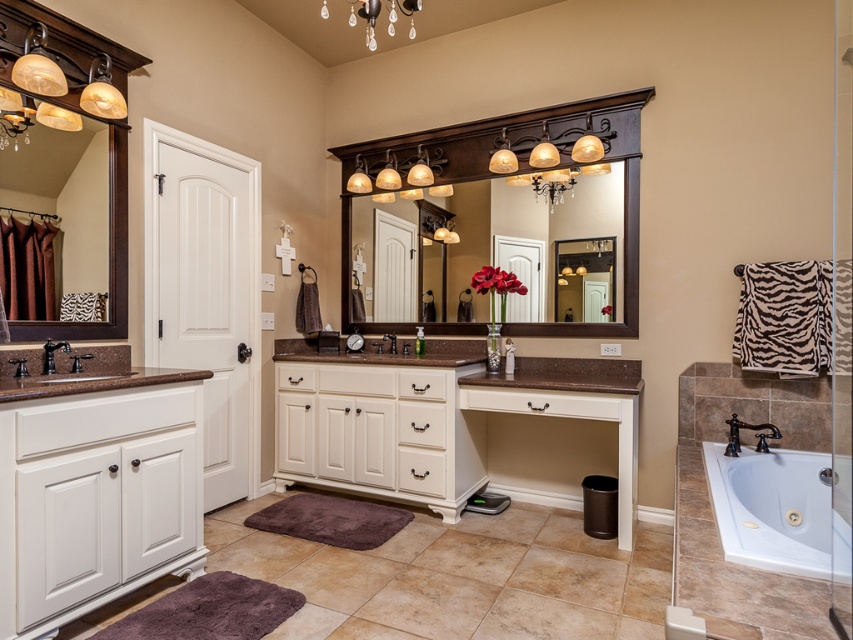
You are a guest in this bathroom and want to take a bath. The crystal glass chandelier at upper center is directly above a certain area. Where should you go to find the white ceramic bathtub at lower right?

The white ceramic bathtub at lower right is located below the crystal glass chandelier at upper center, so you should go to the area directly under the chandelier to find the bathtub.

You are a contractor planning to install a new light fixture in the bathroom. You see the crystal glass chandelier at upper center and the black matte faucet at center. Which object is located to the right of the other?

The crystal glass chandelier at upper center is positioned on the right side of black matte faucet at center.

You are designing a bathroom layout and need to place a new 1.5 meter wide sofa in the corner. The white ceramic bathtub at lower right and the crystal glass chandelier at upper center are already in place. Which object has a larger width that might interfere with the sofa placement?

The white ceramic bathtub at lower right has a larger width than the crystal glass chandelier at upper center, so it might interfere with the sofa placement.